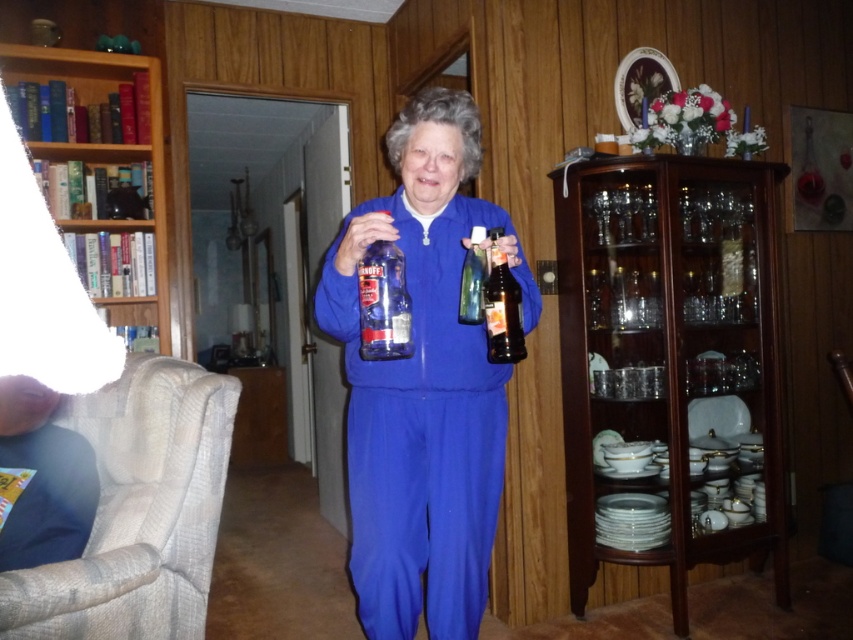
Is transparent plastic bottle at center above translucent glass bottle at center?

Yes.

Is point (407, 346) farther from viewer compared to point (495, 296)?

No, it is not.

Identify the location of transparent plastic bottle at center. This screenshot has width=853, height=640. (383, 304).

Does point (22, 570) come in front of point (485, 289)?

Yes, point (22, 570) is in front of point (485, 289).

Can you confirm if woven fabric armchair at lower left is positioned below translucent glass bottle at center?

Yes.

Is point (36, 620) less distant than point (508, 328)?

Yes.

You are a GUI agent. You are given a task and a screenshot of the screen. Output one action in this format:
    pyautogui.click(x=<x>, y=<y>)
    Task: Click on the woven fabric armchair at lower left
    
    Given the screenshot: What is the action you would take?
    pyautogui.click(x=138, y=509)

Identify the location of transparent glass cabinet at right. This screenshot has height=640, width=853. (671, 355).

In the scene shown: Between transparent glass cabinet at right and transparent plastic bottle at center, which one is positioned higher?

transparent plastic bottle at center is above.

Where is `transparent glass cabinet at right`? Image resolution: width=853 pixels, height=640 pixels. transparent glass cabinet at right is located at coordinates tap(671, 355).